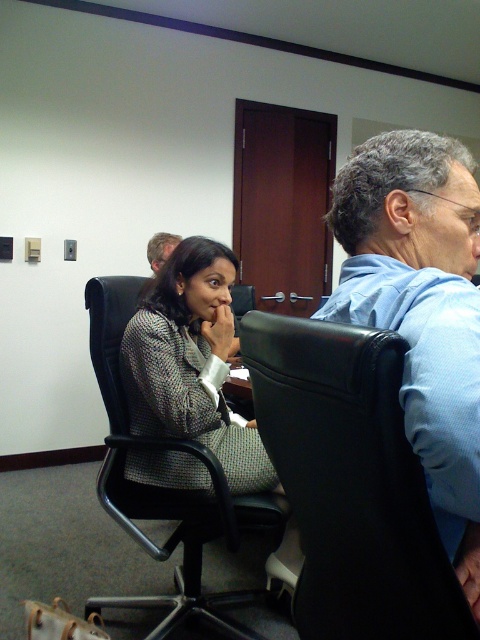
Question: Does patterned fabric jacket at center have a greater width compared to light brown hair at upper left?

Choices:
 (A) no
 (B) yes

Answer: (B)

Question: Can you confirm if black leather swivel chair at right is bigger than patterned fabric jacket at center?

Choices:
 (A) no
 (B) yes

Answer: (A)

Question: Based on their relative distances, which object is nearer to the light brown hair at upper left?

Choices:
 (A) blue cotton shirt at right
 (B) black mesh office chair at center

Answer: (B)

Question: Which point is farther to the camera?

Choices:
 (A) (452, 516)
 (B) (154, 266)

Answer: (B)

Question: Estimate the real-world distances between objects in this image. Which object is closer to the blue cotton shirt at right?

Choices:
 (A) light brown hair at upper left
 (B) patterned fabric jacket at center

Answer: (B)

Question: Is patterned fabric jacket at center smaller than light brown hair at upper left?

Choices:
 (A) yes
 (B) no

Answer: (B)